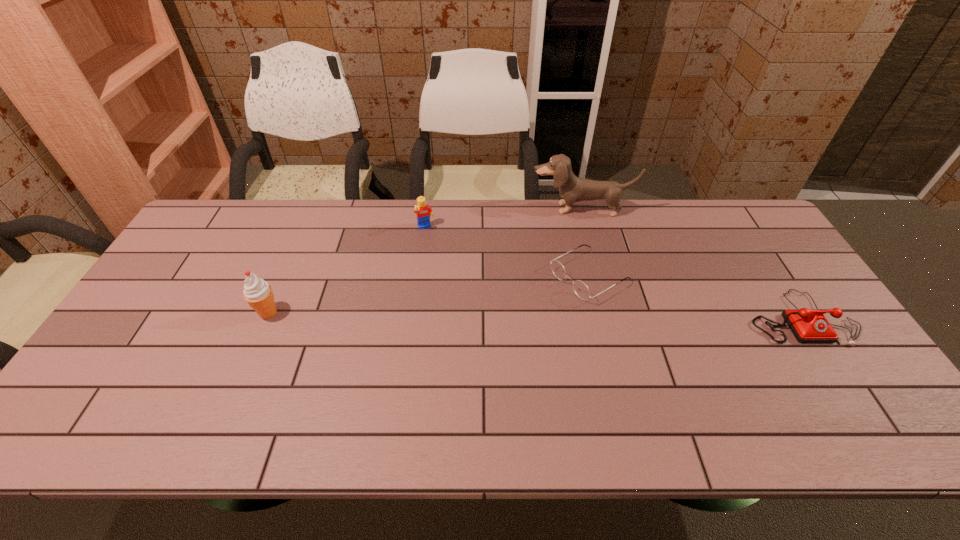
Locate an element on the screen. This screenshot has height=540, width=960. icecream is located at coordinates (258, 293).

Find the location of a particular element. the second tallest object is located at coordinates (258, 293).

Locate an element on the screen. the rightmost object is located at coordinates (807, 325).

Locate an element on the screen. the fourth tallest object is located at coordinates (807, 325).

At what (x,y) coordinates should I click in order to perform the action: click on the third tallest object. Please return your answer as a coordinate pair (x, y). This screenshot has width=960, height=540. Looking at the image, I should click on (423, 212).

I want to click on Lego, so click(423, 212).

This screenshot has width=960, height=540. In order to click on the farthest object in this screenshot , I will do `click(572, 189)`.

This screenshot has height=540, width=960. Identify the location of puppy. click(x=572, y=189).

I want to click on the shortest object, so click(x=581, y=290).

Locate an element on the screen. The width and height of the screenshot is (960, 540). free space located 0.080m on the left of the icecream is located at coordinates (227, 313).